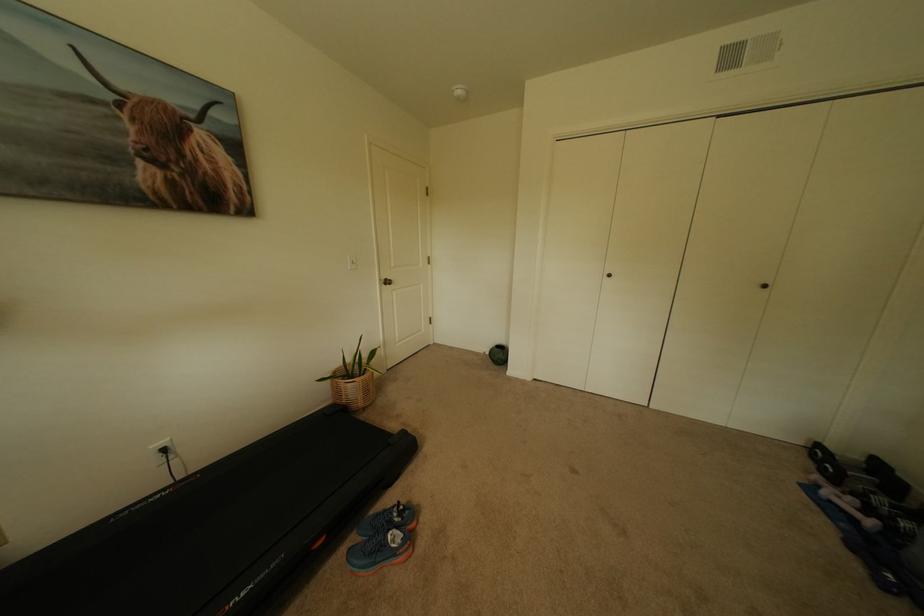
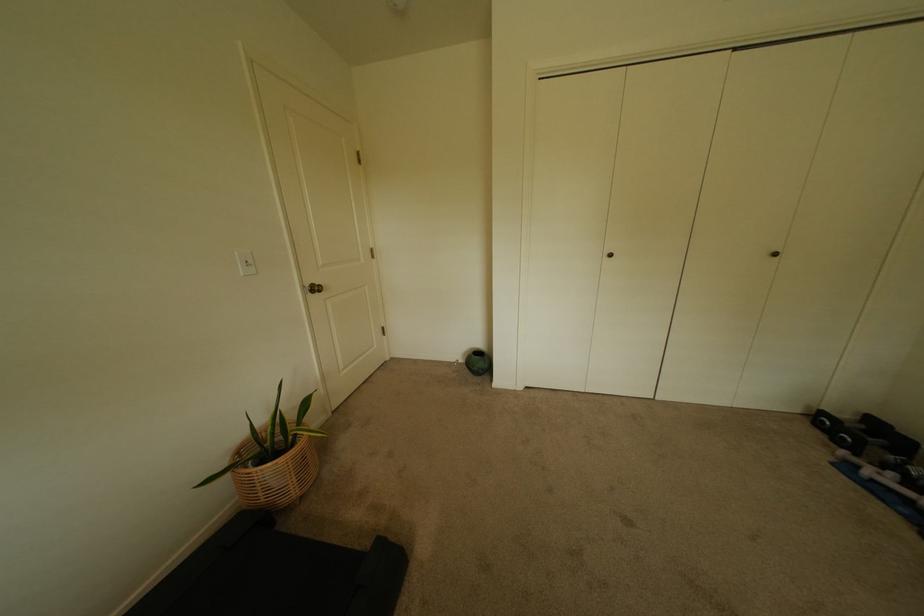
Find the pixel in the second image that matches point (617, 277) in the first image.

(618, 256)